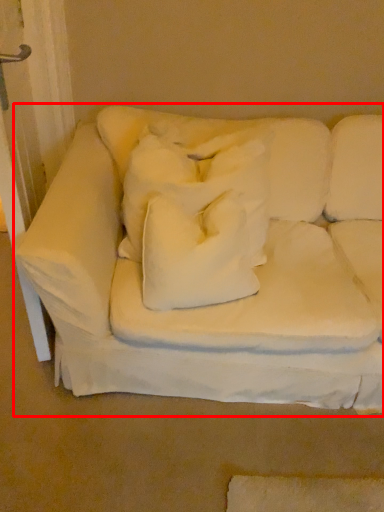
Question: From the image's perspective, what is the correct spatial relationship of studio couch (annotated by the red box) in relation to pillow?

Choices:
 (A) below
 (B) above

Answer: (B)